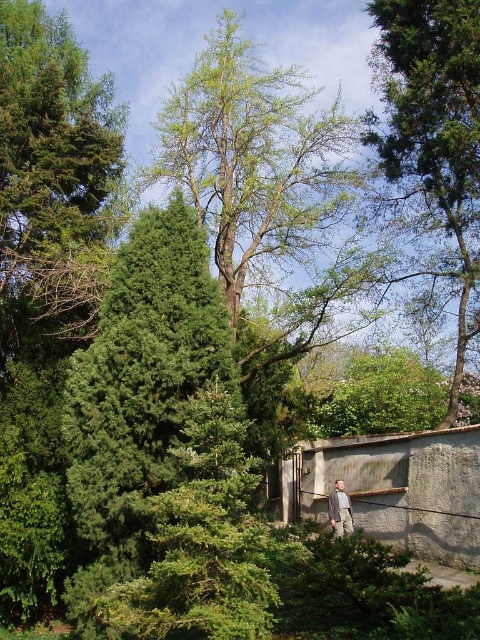
Is point (199, 218) positioned before point (283, 513)?

Yes, it is.

Who is positioned more to the right, green leafy tree at upper center or gray concrete wall at lower right?

gray concrete wall at lower right

The width and height of the screenshot is (480, 640). What do you see at coordinates (253, 157) in the screenshot? I see `green leafy tree at upper center` at bounding box center [253, 157].

This screenshot has width=480, height=640. Identify the location of green leafy tree at upper center. (253, 157).

Can you confirm if green leafy tree at upper right is taller than khaki fabric jacket at lower right?

In fact, green leafy tree at upper right may be shorter than khaki fabric jacket at lower right.

Which of these two, green leafy tree at upper right or khaki fabric jacket at lower right, stands taller?

With more height is khaki fabric jacket at lower right.

You are a GUI agent. You are given a task and a screenshot of the screen. Output one action in this format:
    pyautogui.click(x=<x>, y=<y>)
    Task: Click on the green leafy tree at upper right
    This screenshot has height=640, width=480.
    Given the screenshot: What is the action you would take?
    pyautogui.click(x=434, y=131)

Find the location of a particular element. The height and width of the screenshot is (640, 480). green leafy tree at upper right is located at coordinates [x=434, y=131].

Does gray concrete wall at lower right have a greater height compared to khaki fabric jacket at lower right?

Yes.

Between gray concrete wall at lower right and khaki fabric jacket at lower right, which one has more height?

Standing taller between the two is gray concrete wall at lower right.

The height and width of the screenshot is (640, 480). In order to click on gray concrete wall at lower right in this screenshot , I will do `click(394, 488)`.

Locate an element on the screen. gray concrete wall at lower right is located at coordinates (394, 488).